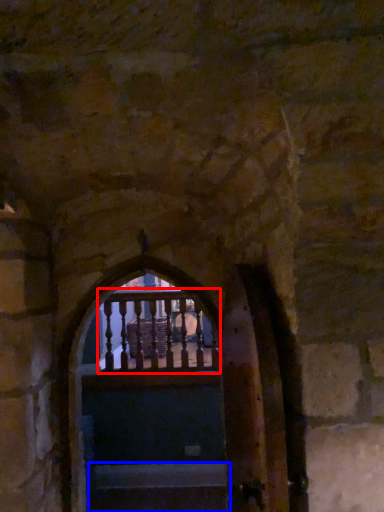
Question: Which of the following is the closest to the observer, balcony (highlighted by a red box) or stairs (highlighted by a blue box)?

Choices:
 (A) balcony
 (B) stairs

Answer: (B)